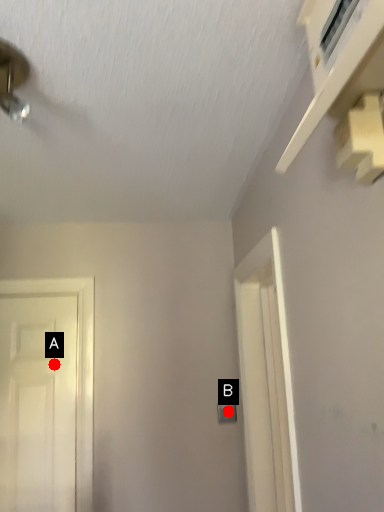
Question: Two points are circled on the image, labeled by A and B beside each circle. Which point is closer to the camera taking this photo?

Choices:
 (A) A is closer
 (B) B is closer

Answer: (A)